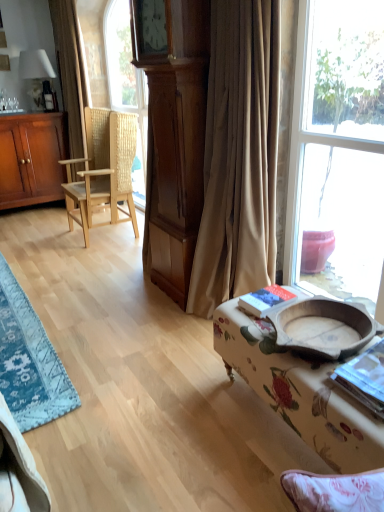
In order to click on matte brown cabinet at left in this screenshot , I will do `click(32, 158)`.

This screenshot has width=384, height=512. What do you see at coordinates (29, 361) in the screenshot?
I see `blue woven rug at lower left` at bounding box center [29, 361].

Find the location of a particular element. This screenshot has height=512, width=384. brown textured curtain at left, which ranks as the 1th curtain in back-to-front order is located at coordinates (71, 71).

In order to click on natural wood woven chair at left in this screenshot , I will do `click(103, 169)`.

This screenshot has width=384, height=512. I want to click on matte brown cabinet at left, so click(32, 158).

Is point (113, 206) less distant than point (216, 327)?

No, (113, 206) is behind (216, 327).

How different are the orientations of natural wood woven chair at left and floral fabric ottoman at lower right in degrees?

The angle between the facing direction of natural wood woven chair at left and the facing direction of floral fabric ottoman at lower right is 1.66 degrees.

Does natural wood woven chair at left turn towards floral fabric ottoman at lower right?

No.

Does natural wood woven chair at left have a greater width compared to floral fabric ottoman at lower right?

Indeed, natural wood woven chair at left has a greater width compared to floral fabric ottoman at lower right.

Is floral fabric ottoman at lower right at the right side of beige fabric curtain at center, acting as the first curtain starting from the front?

Indeed, floral fabric ottoman at lower right is positioned on the right side of beige fabric curtain at center, acting as the first curtain starting from the front.

From a real-world perspective, is floral fabric ottoman at lower right on top of beige fabric curtain at center, placed as the second curtain when sorted from back to front?

No, from a real-world perspective, floral fabric ottoman at lower right is not above beige fabric curtain at center, placed as the second curtain when sorted from back to front.

Is floral fabric ottoman at lower right turned away from beige fabric curtain at center, placed as the second curtain when sorted from back to front?

No, beige fabric curtain at center, placed as the second curtain when sorted from back to front, is not at the back of floral fabric ottoman at lower right.

From the picture: Is floral fabric ottoman at lower right outside of beige fabric curtain at center, positioned as the 2th curtain in left-to-right order?

Absolutely, floral fabric ottoman at lower right is external to beige fabric curtain at center, positioned as the 2th curtain in left-to-right order.

Considering the positions of objects matte brown cabinet at left and beige fabric curtain at center, placed as the second curtain when sorted from back to front, in the image provided, who is more to the left, matte brown cabinet at left or beige fabric curtain at center, placed as the second curtain when sorted from back to front,?

Positioned to the left is matte brown cabinet at left.

How many degrees apart are the facing directions of matte brown cabinet at left and beige fabric curtain at center, acting as the first curtain starting from the front?

94.2 degrees separate the facing orientations of matte brown cabinet at left and beige fabric curtain at center, acting as the first curtain starting from the front.

Which is behind, matte brown cabinet at left or beige fabric curtain at center, acting as the first curtain starting from the front?

matte brown cabinet at left is further away from the camera.

Considering the relative positions of beige fabric curtain at center, placed as the second curtain when sorted from back to front, and brown textured curtain at left, which ranks as the 1th curtain in back-to-front order, in the image provided, is beige fabric curtain at center, placed as the second curtain when sorted from back to front, to the right of brown textured curtain at left, which ranks as the 1th curtain in back-to-front order, from the viewer's perspective?

Correct, you'll find beige fabric curtain at center, placed as the second curtain when sorted from back to front, to the right of brown textured curtain at left, which ranks as the 1th curtain in back-to-front order.

Is there a large distance between beige fabric curtain at center, placed as the second curtain when sorted from back to front, and brown textured curtain at left, which is the 2th curtain in front-to-back order?

Yes, beige fabric curtain at center, placed as the second curtain when sorted from back to front, and brown textured curtain at left, which is the 2th curtain in front-to-back order, are quite far apart.

From a real-world perspective, is beige fabric curtain at center, positioned as the 2th curtain in left-to-right order, under brown textured curtain at left, the first curtain when ordered from left to right?

Correct, in the physical world, beige fabric curtain at center, positioned as the 2th curtain in left-to-right order, is lower than brown textured curtain at left, the first curtain when ordered from left to right.

How different are the orientations of floral fabric ottoman at lower right and blue woven rug at lower left in degrees?

There is a 86.6-degree angle between the facing directions of floral fabric ottoman at lower right and blue woven rug at lower left.

Which is more to the left, floral fabric ottoman at lower right or blue woven rug at lower left?

Positioned to the left is blue woven rug at lower left.

Can you confirm if floral fabric ottoman at lower right is taller than blue woven rug at lower left?

Yes.

Find the location of `table behind the floral fabric ottoman at lower right`. table behind the floral fabric ottoman at lower right is located at coordinates (29, 361).

From a real-world perspective, is blue woven rug at lower left above or below matte brown cabinet at left?

blue woven rug at lower left is below matte brown cabinet at left.

Is matte brown cabinet at left at the back of blue woven rug at lower left?

blue woven rug at lower left does not have its back to matte brown cabinet at left.

Is blue woven rug at lower left taller or shorter than matte brown cabinet at left?

Considering their sizes, blue woven rug at lower left has less height than matte brown cabinet at left.

Can you confirm if blue woven rug at lower left is thinner than matte brown cabinet at left?

In fact, blue woven rug at lower left might be wider than matte brown cabinet at left.

This screenshot has height=512, width=384. What are the coordinates of `cabinetry positioned vertically above the floral fabric ottoman at lower right (from a real-world perspective)` in the screenshot? It's located at (32, 158).

Which is more to the right, matte brown cabinet at left or floral fabric ottoman at lower right?

From the viewer's perspective, floral fabric ottoman at lower right appears more on the right side.

Is matte brown cabinet at left not within floral fabric ottoman at lower right?

matte brown cabinet at left is positioned outside floral fabric ottoman at lower right.

Is matte brown cabinet at left turned away from floral fabric ottoman at lower right?

No, matte brown cabinet at left's orientation is not away from floral fabric ottoman at lower right.

The width and height of the screenshot is (384, 512). I want to click on chair that appears above the floral fabric ottoman at lower right (from the image's perspective), so click(103, 169).

At what (x,y) coordinates should I click in order to perform the action: click on studio couch located below the beige fabric curtain at center, placed as the second curtain when sorted from back to front (from the image's perspective). Please return your answer as a coordinate pair (x, y). The image size is (384, 512). Looking at the image, I should click on (299, 391).

From the image, which object appears to be farther from brown textured curtain at left, which is the 2th curtain in front-to-back order, natural wood woven chair at left or beige fabric curtain at center, acting as the first curtain starting from the front?

beige fabric curtain at center, acting as the first curtain starting from the front, is further to brown textured curtain at left, which is the 2th curtain in front-to-back order.

Looking at the image, which one is located further to floral fabric ottoman at lower right, matte brown cabinet at left or blue woven rug at lower left?

matte brown cabinet at left is positioned further to the anchor floral fabric ottoman at lower right.

From the image, which object appears to be farther from blue woven rug at lower left, brown textured curtain at left, the second curtain viewed from the right, or matte brown cabinet at left?

The object further to blue woven rug at lower left is brown textured curtain at left, the second curtain viewed from the right.

Which object lies nearer to the anchor point matte brown cabinet at left, brown textured curtain at left, the first curtain when ordered from left to right, or natural wood woven chair at left?

The object closer to matte brown cabinet at left is brown textured curtain at left, the first curtain when ordered from left to right.

When comparing their distances from floral fabric ottoman at lower right, does matte brown cabinet at left or brown textured curtain at left, the first curtain when ordered from left to right, seem further?

Among the two, matte brown cabinet at left is located further to floral fabric ottoman at lower right.

Which object lies nearer to the anchor point natural wood woven chair at left, beige fabric curtain at center, positioned as the first curtain in right-to-left order, or floral fabric ottoman at lower right?

Among the two, beige fabric curtain at center, positioned as the first curtain in right-to-left order, is located nearer to natural wood woven chair at left.

Which object lies nearer to the anchor point matte brown cabinet at left, blue woven rug at lower left or floral fabric ottoman at lower right?

blue woven rug at lower left.

Which object lies further to the anchor point beige fabric curtain at center, acting as the first curtain starting from the front, natural wood woven chair at left or brown textured curtain at left, the second curtain viewed from the right?

Based on the image, brown textured curtain at left, the second curtain viewed from the right, appears to be further to beige fabric curtain at center, acting as the first curtain starting from the front.

Where is `table between beige fabric curtain at center, positioned as the 2th curtain in left-to-right order, and brown textured curtain at left, which ranks as the 1th curtain in back-to-front order, along the z-axis`? table between beige fabric curtain at center, positioned as the 2th curtain in left-to-right order, and brown textured curtain at left, which ranks as the 1th curtain in back-to-front order, along the z-axis is located at coordinates (29, 361).

I want to click on chair positioned between beige fabric curtain at center, placed as the second curtain when sorted from back to front, and matte brown cabinet at left from near to far, so click(x=103, y=169).

At what (x,y) coordinates should I click in order to perform the action: click on curtain between blue woven rug at lower left and matte brown cabinet at left in the front-back direction. Please return your answer as a coordinate pair (x, y). This screenshot has width=384, height=512. Looking at the image, I should click on (71, 71).

This screenshot has height=512, width=384. Find the location of `chair positioned between beige fabric curtain at center, positioned as the 2th curtain in left-to-right order, and brown textured curtain at left, the second curtain viewed from the right, from near to far`. chair positioned between beige fabric curtain at center, positioned as the 2th curtain in left-to-right order, and brown textured curtain at left, the second curtain viewed from the right, from near to far is located at coordinates (103, 169).